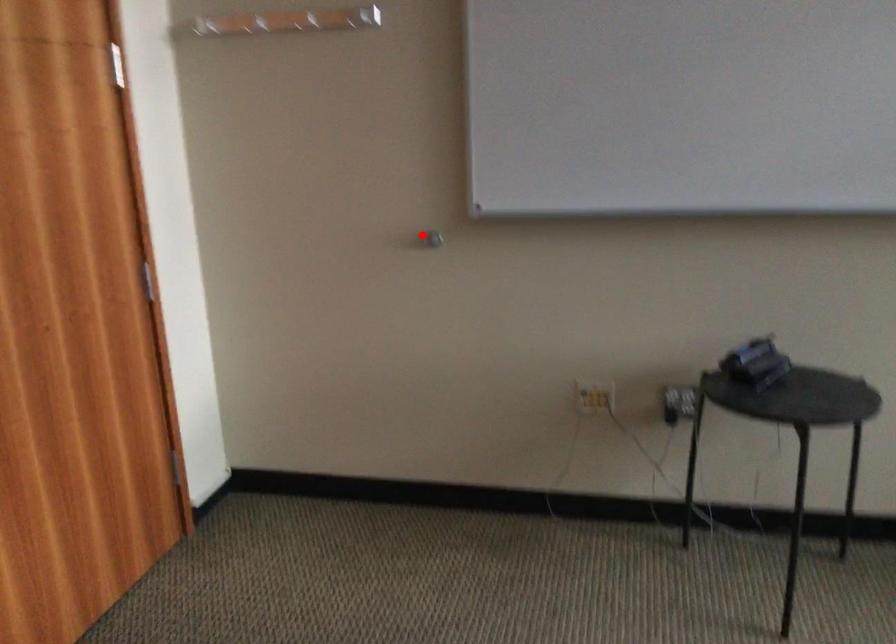
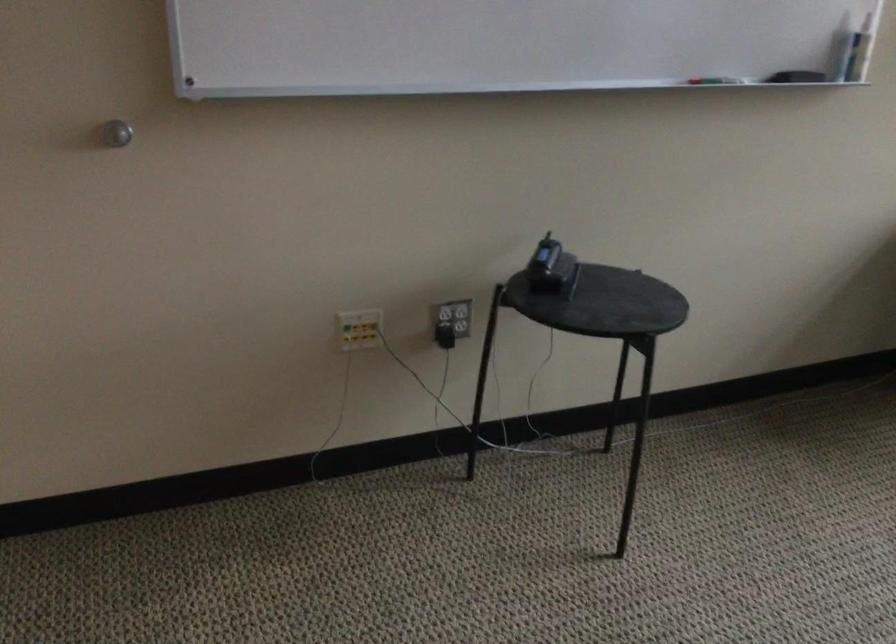
Question: I am providing you with two images of the same scene from different viewpoints. A red point is marked on the first image. At the location where the point appears in image 1, is it still visible in image 2?

Choices:
 (A) Yes
 (B) No

Answer: (A)